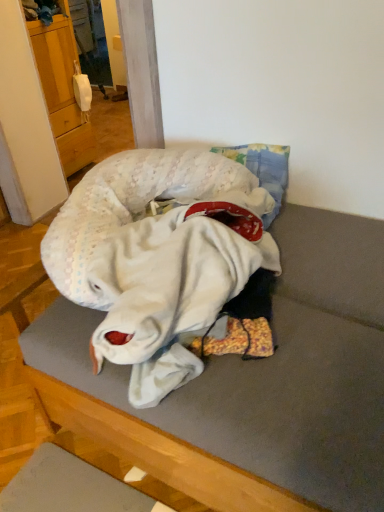
Question: In terms of height, does white knitted baby at center look taller or shorter compared to white fabric pillow at center?

Choices:
 (A) short
 (B) tall

Answer: (A)

Question: Considering the relative positions of white knitted baby at center and white fabric pillow at center in the image provided, is white knitted baby at center to the left or to the right of white fabric pillow at center?

Choices:
 (A) left
 (B) right

Answer: (A)

Question: Which of these objects is positioned farthest from the wooden cabinet at left?

Choices:
 (A) white knitted baby at center
 (B) white fabric pillow at center

Answer: (B)

Question: Which of these objects is positioned closest to the white knitted baby at center?

Choices:
 (A) white fabric pillow at center
 (B) wooden cabinet at left

Answer: (A)